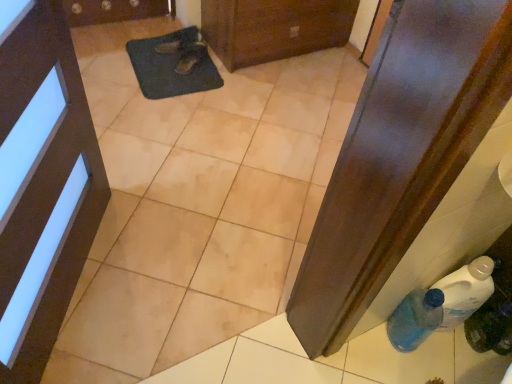
You are a GUI agent. You are given a task and a screenshot of the screen. Output one action in this format:
    pyautogui.click(x=<x>, y=<y>)
    Task: Click on the free space to the left of brown leather shoe at center, the 2th footwear in the top-to-bottom sequence
    The image size is (512, 384).
    Given the screenshot: What is the action you would take?
    (155, 60)